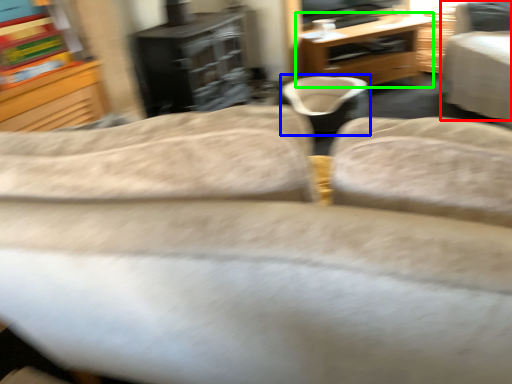
Question: Based on their relative distances, which object is nearer to chair (highlighted by a red box)? Choose from bean bag chair (highlighted by a blue box) and desk (highlighted by a green box).

Choices:
 (A) bean bag chair
 (B) desk

Answer: (A)